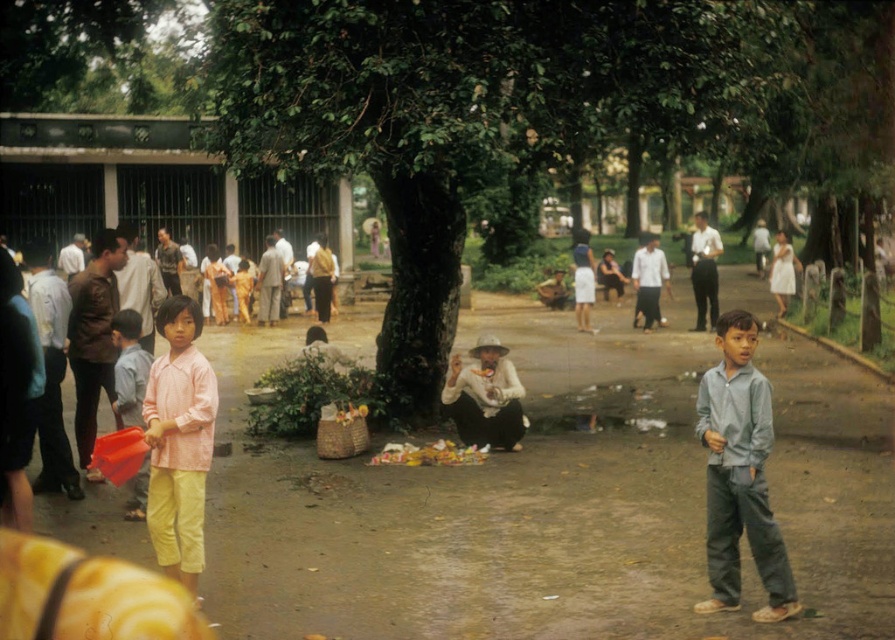
Question: Which point is closer to the camera?

Choices:
 (A) (207, 435)
 (B) (755, 484)
 (C) (405, 252)
 (D) (128, 404)

Answer: (B)

Question: Among these objects, which one is nearest to the camera?

Choices:
 (A) light blue shirt at center
 (B) green leafy tree at center
 (C) matte pink shirt at left
 (D) pink woven shirt at center

Answer: (A)

Question: Considering the relative positions of green leafy tree at center and pink woven shirt at center in the image provided, where is green leafy tree at center located with respect to pink woven shirt at center?

Choices:
 (A) below
 (B) above

Answer: (B)

Question: Does green leafy tree at center appear on the left side of matte pink shirt at left?

Choices:
 (A) yes
 (B) no

Answer: (B)

Question: Is green leafy tree at center smaller than light blue shirt at center?

Choices:
 (A) no
 (B) yes

Answer: (A)

Question: Which point is farther from the camera taking this photo?

Choices:
 (A) (742, 355)
 (B) (305, 141)
 (C) (135, 364)
 (D) (175, 552)

Answer: (B)